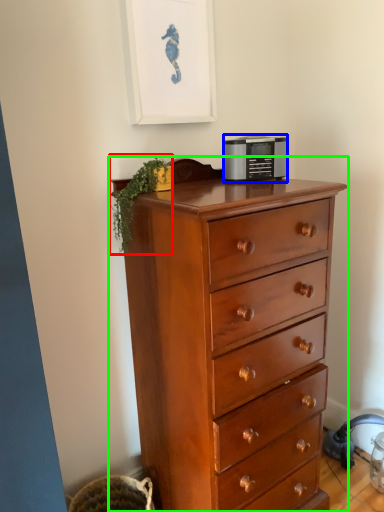
Question: Based on their relative distances, which object is nearer to plant (highlighted by a red box)? Choose from appliance (highlighted by a blue box) and chest of drawers (highlighted by a green box).

Choices:
 (A) appliance
 (B) chest of drawers

Answer: (A)